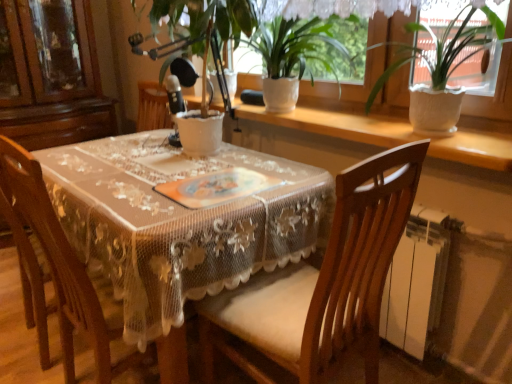
Question: From the image's perspective, relative to white textured window sill at upper center, is white ceramic pot at upper right, which ranks as the third houseplant in left-to-right order, above or below?

Choices:
 (A) above
 (B) below

Answer: (A)

Question: Visually, is white ceramic pot at upper right, which ranks as the third houseplant in left-to-right order, positioned to the left or to the right of white textured window sill at upper center?

Choices:
 (A) left
 (B) right

Answer: (B)

Question: Which is farther from the white ceramic pot at center, which is the third houseplant in right-to-left order?

Choices:
 (A) wooden chair at center, the 1th chair from the left
 (B) white lace tablecloth at center
 (C) white textured window sill at upper center
 (D) wooden chair at center, the second chair viewed from the left
 (E) white ceramic pot at upper right, which is the 1th houseplant in right-to-left order

Answer: (A)

Question: Estimate the real-world distances between objects in this image. Which object is farther from the white ceramic pot at upper right, which ranks as the third houseplant in left-to-right order?

Choices:
 (A) white ceramic pot at center, the first houseplant from the left
 (B) wooden chair at center, the 1th chair from the left
 (C) white lace tablecloth at center
 (D) wooden chair at center, which is the first chair in right-to-left order
 (E) white ceramic pot at upper center, arranged as the 2th houseplant when viewed from the right

Answer: (B)